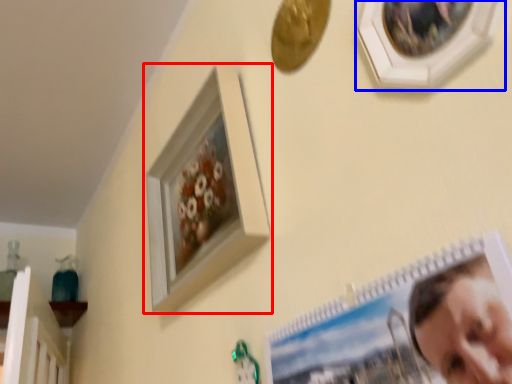
Question: Which object is further to the camera taking this photo, picture frame (highlighted by a red box) or picture frame (highlighted by a blue box)?

Choices:
 (A) picture frame
 (B) picture frame

Answer: (A)